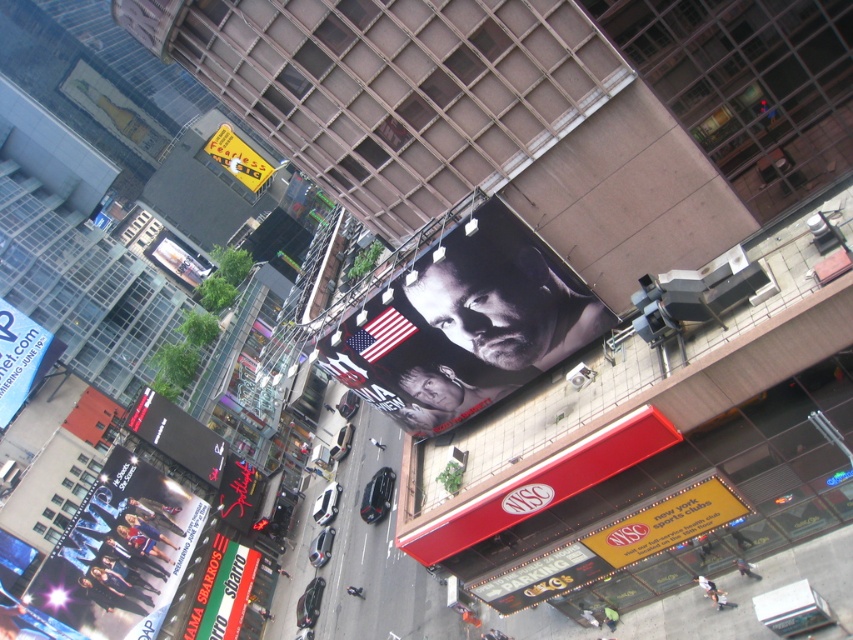
You are standing at the center of the image and want to find the green fabric sign at lower left. Based on the coordinates given, in which direction should you look to locate it?

The green fabric sign at lower left is located at coordinates point (222, 592), so you should look to the lower left direction to locate it.

You are a pedestrian standing at the corner of the street and looking down at the two signs below you. Which sign, the green fabric sign at lower left or the black glossy sign at lower left, is narrower?

The green fabric sign at lower left is narrower than the black glossy sign at lower left because it has a lesser width compared to the black glossy sign at lower left.

You are standing at the point with coordinates point (555, 579) and want to look towards the point with coordinates point (171, 429). Will the billboard with the black and white portrait block your view?

Point (171, 429) is behind point (555, 579), so the billboard with the black and white portrait will block your view towards point (171, 429).